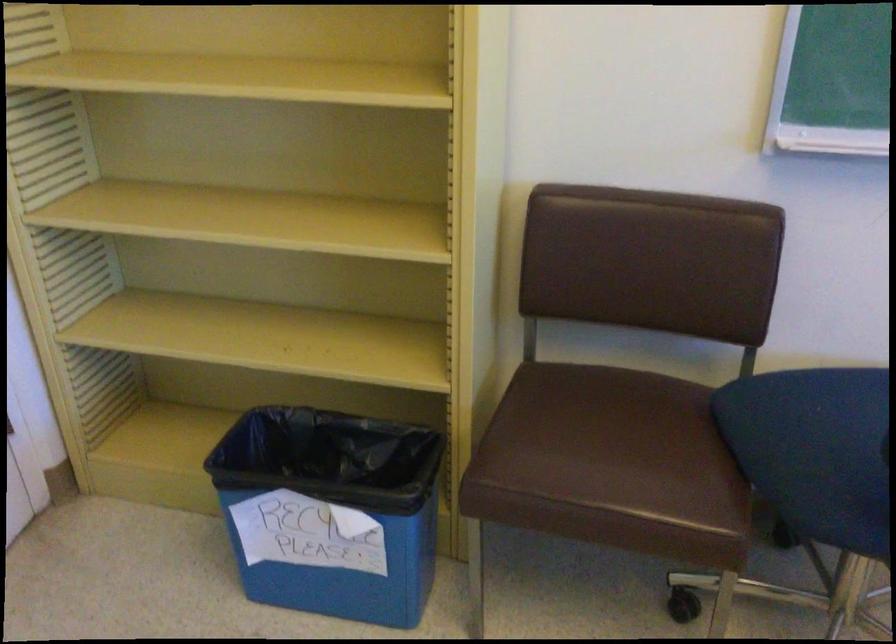
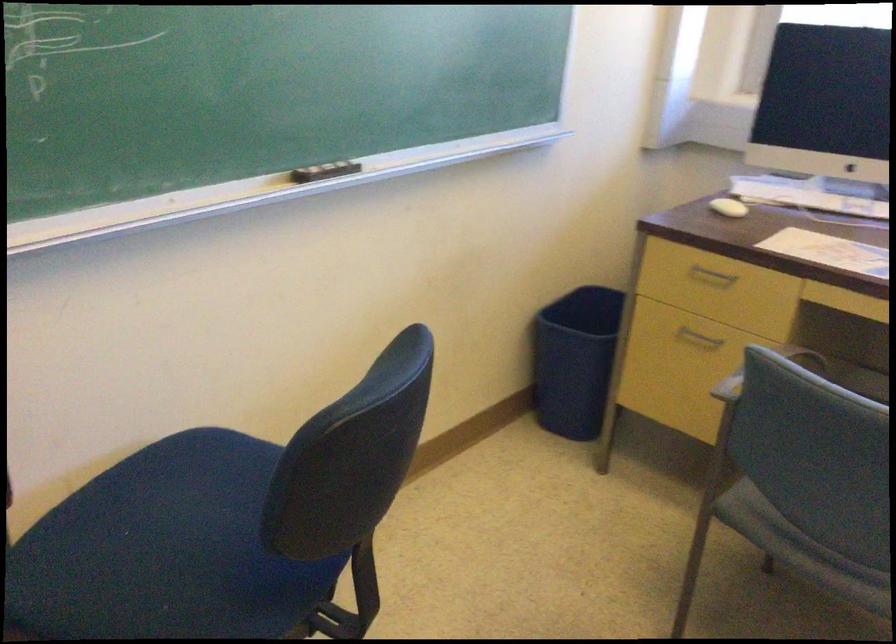
Question: The first image is from the beginning of the video and the second image is from the end. How did the camera likely rotate when shooting the video?

Choices:
 (A) Left
 (B) Right
 (C) Up
 (D) Down

Answer: (B)